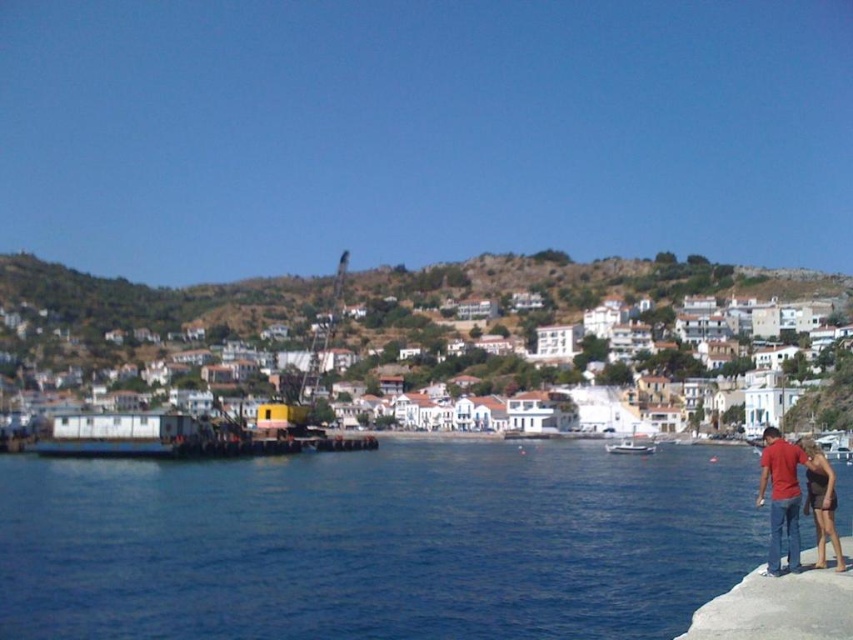
You are a photographer planning to capture a landscape shot that includes both the blue water at lower left and the white matte buildings at center. Based on the scene, which object should appear closer to the bottom of the photo?

The blue water at lower left should appear closer to the bottom of the photo because it is shorter than the white matte buildings at center.

You are a photographer planning to capture the entire scene in one shot. The blue water at lower left and the white matte buildings at center are both in your frame. Considering their widths, which object should you prioritize framing closer to avoid cropping either?

Since the blue water at lower left is narrower than the white matte buildings at center, you should prioritize framing closer to the white matte buildings at center to accommodate their wider width without cropping.

You are standing on the pier and want to walk towards the two points marked in the image. Which point, point [836,540] or point [614,449], is closer to you?

Point [836,540] is closer to you because it is in front of point [614,449].